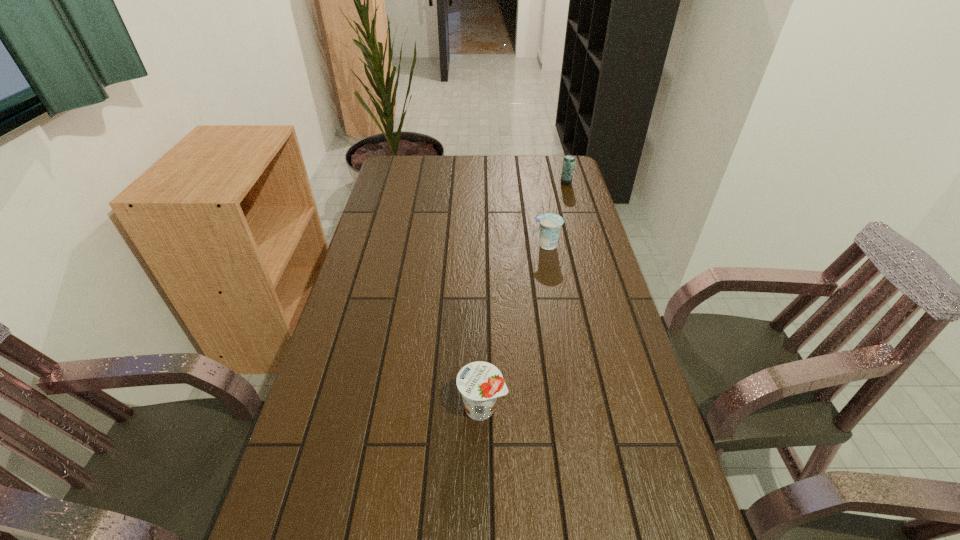
Identify the location of beer can situated at the right edge. The height and width of the screenshot is (540, 960). (569, 161).

Image resolution: width=960 pixels, height=540 pixels. Identify the location of yogurt that is at the right edge. (550, 224).

Find the location of a particular element. object that is at the far right corner is located at coordinates (569, 161).

Locate an element on the screen. vacant position at the far edge of the desktop is located at coordinates (509, 158).

This screenshot has height=540, width=960. Identify the location of vacant area at the left edge of the desktop. (384, 293).

Identify the location of vacant space at the right edge. (601, 275).

At what (x,y) coordinates should I click in order to perform the action: click on vacant area at the far left corner. Please return your answer as a coordinate pair (x, y). This screenshot has height=540, width=960. Looking at the image, I should click on (412, 181).

Identify the location of vacant space that's between the nearer yogurt and the second farthest object. This screenshot has height=540, width=960. (514, 327).

I want to click on free spot between the nearest object and the beer can, so click(524, 295).

At what (x,y) coordinates should I click in order to perform the action: click on free space between the nearest object and the right yogurt. Please return your answer as a coordinate pair (x, y). The height and width of the screenshot is (540, 960). Looking at the image, I should click on (514, 327).